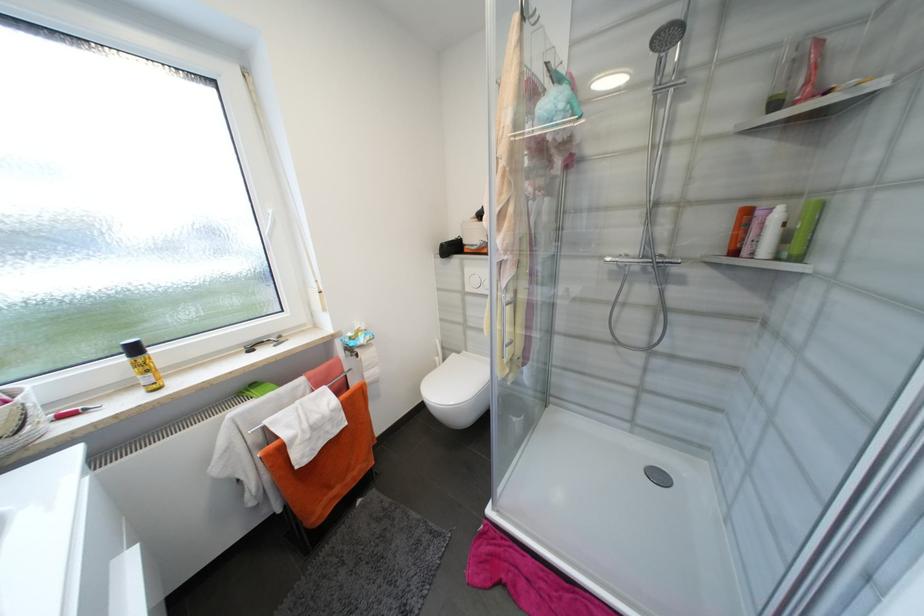
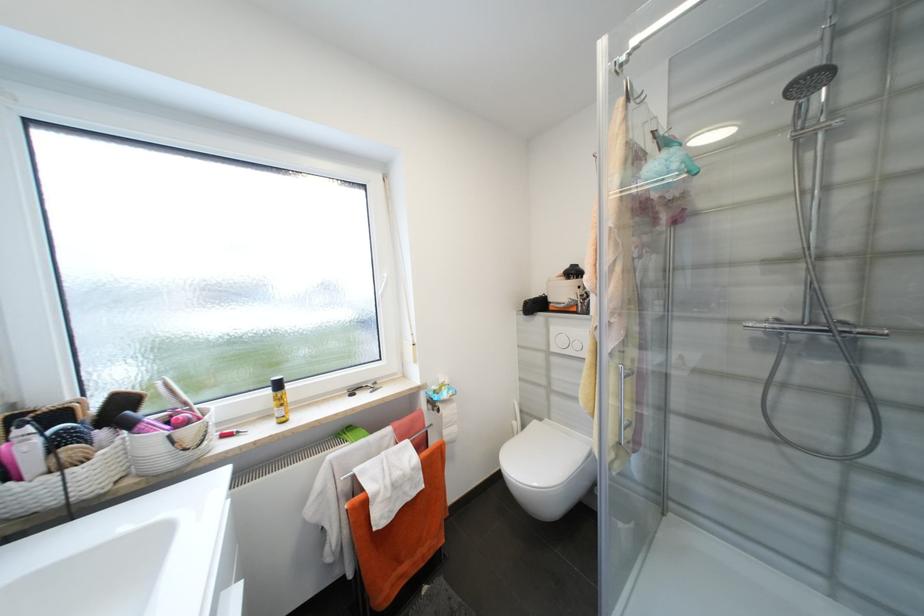
Find the pixel in the second image that matches point 662,55 in the first image.

(799, 103)